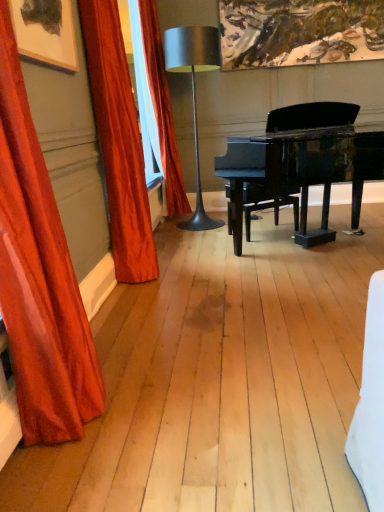
Identify the location of free space in front of satin red curtain at left, arranged as the second curtain when viewed from the back. The width and height of the screenshot is (384, 512). (153, 293).